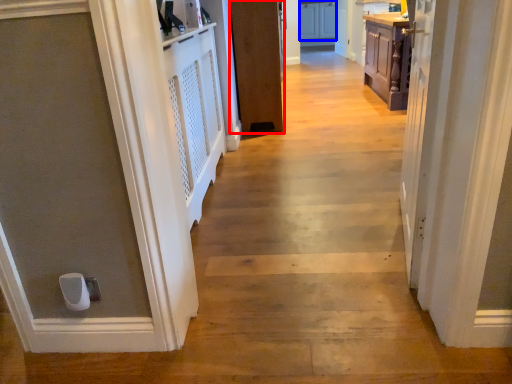
Question: Among these objects, which one is farthest to the camera, door (highlighted by a red box) or cabinetry (highlighted by a blue box)?

Choices:
 (A) door
 (B) cabinetry

Answer: (B)